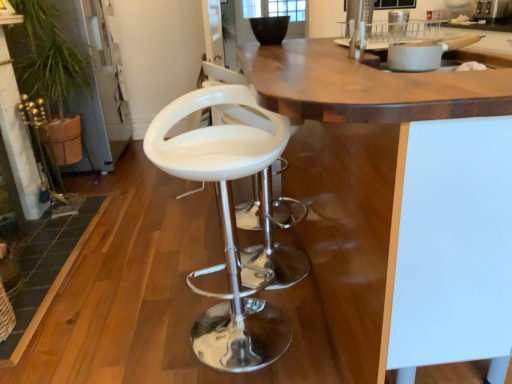
Question: In the image, is white glossy bar stool at center positioned in front of or behind wooden at center?

Choices:
 (A) front
 (B) behind

Answer: (B)

Question: From their relative heights in the image, would you say white glossy bar stool at center is taller or shorter than wooden at center?

Choices:
 (A) short
 (B) tall

Answer: (A)

Question: Considering the real-world distances, which object is closest to the white glossy bar stool at center?

Choices:
 (A) white ceramic pot at upper right
 (B) wooden at center

Answer: (B)

Question: Estimate the real-world distances between objects in this image. Which object is closer to the white ceramic pot at upper right?

Choices:
 (A) white glossy bar stool at center
 (B) wooden at center

Answer: (B)